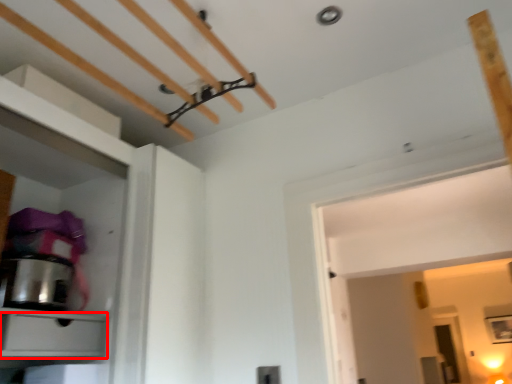
Question: From the image's perspective, what is the correct spatial relationship of drawer (annotated by the red box) in relation to appliance?

Choices:
 (A) above
 (B) below

Answer: (B)